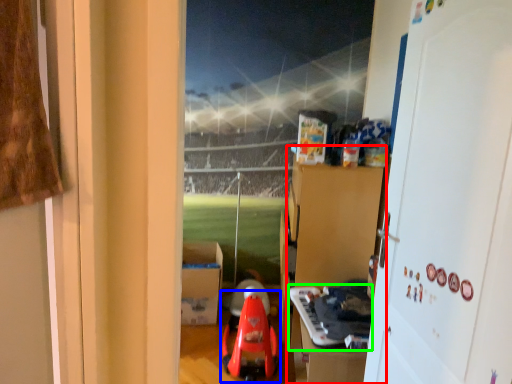
Question: Which object is positioned closest to dresser (highlighted by a red box)? Select from toy (highlighted by a blue box) and toy (highlighted by a green box).

Choices:
 (A) toy
 (B) toy

Answer: (B)